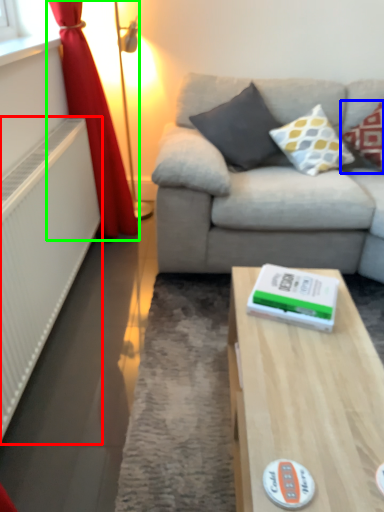
Question: Based on their relative distances, which object is nearer to radiator (highlighted by a red box)? Choose from pillow (highlighted by a blue box) and curtain (highlighted by a green box).

Choices:
 (A) pillow
 (B) curtain

Answer: (B)